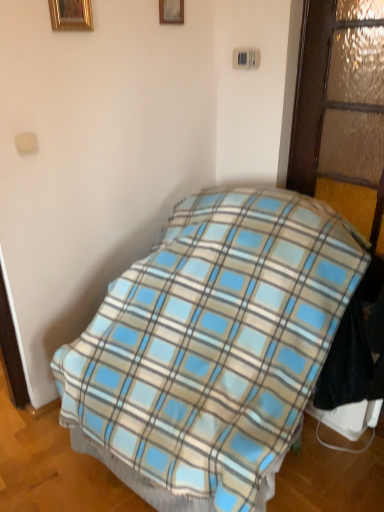
Question: From a real-world perspective, is gold metallic picture frame at upper left, the first picture frame viewed from the left, above or below textured frosted glass door at right?

Choices:
 (A) above
 (B) below

Answer: (A)

Question: From the image's perspective, is gold metallic picture frame at upper left, the second picture frame in the right-to-left sequence, above or below textured frosted glass door at right?

Choices:
 (A) below
 (B) above

Answer: (B)

Question: Based on their relative distances, which object is farther from the gold metallic picture frame at upper left, which is the second picture frame in back-to-front order?

Choices:
 (A) textured frosted glass door at right
 (B) blue plaid blanket at center
 (C) wooden picture frame at upper center, arranged as the 2th picture frame when viewed from the left

Answer: (B)

Question: Which object is positioned farthest from the textured frosted glass door at right?

Choices:
 (A) wooden picture frame at upper center, arranged as the 2th picture frame when viewed from the left
 (B) blue plaid blanket at center
 (C) gold metallic picture frame at upper left, the first picture frame viewed from the left

Answer: (C)